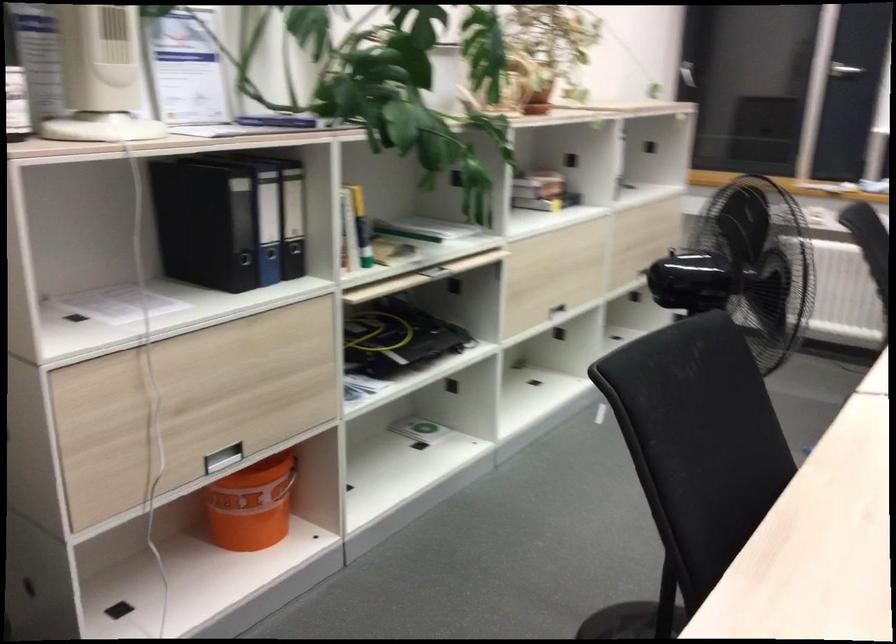
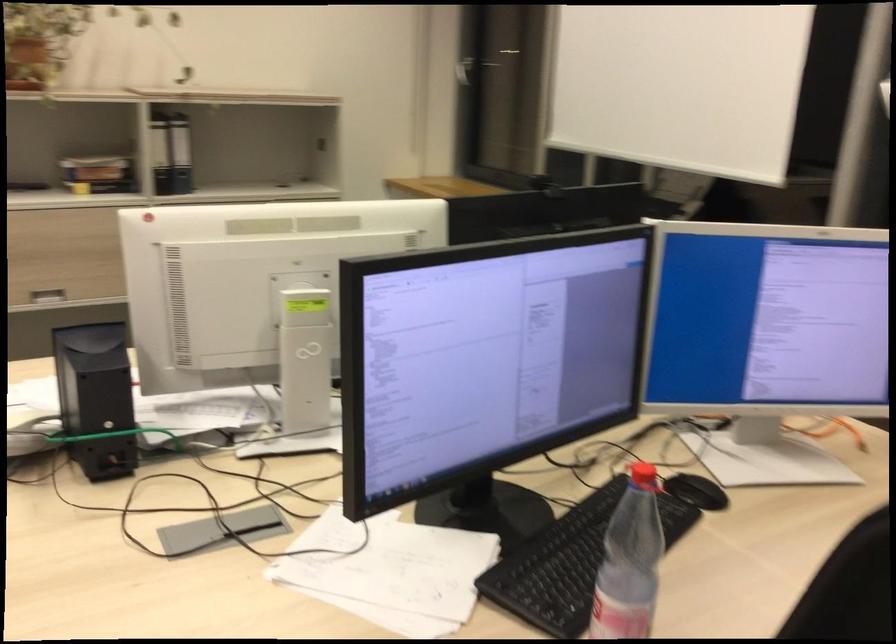
Locate, in the second image, the point that corresponds to (x=556, y=194) in the first image.

(105, 175)